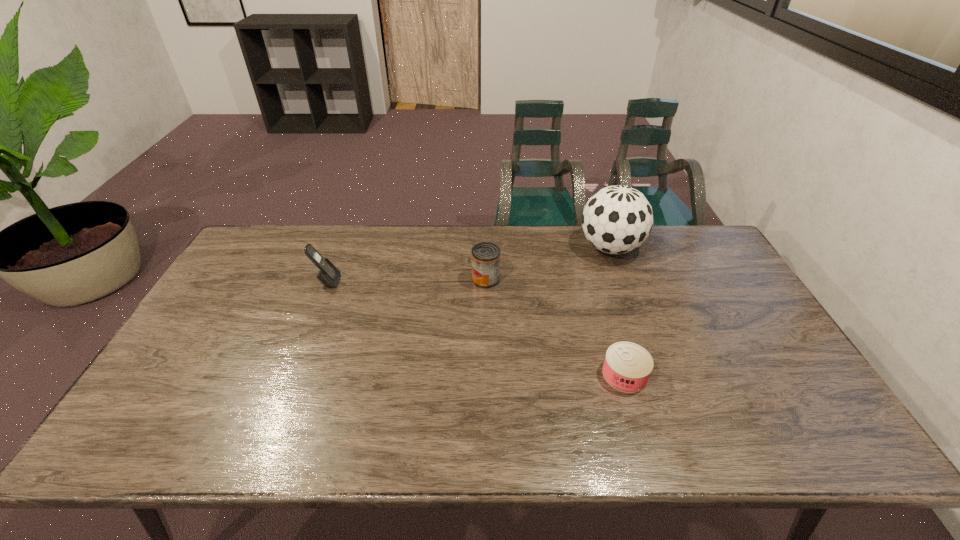
Locate an element on the screen. The width and height of the screenshot is (960, 540). empty space between the third object from right to left and the shorter can is located at coordinates (555, 327).

At what (x,y) coordinates should I click in order to perform the action: click on vacant space that's between the shortest object and the leftmost object. Please return your answer as a coordinate pair (x, y). The height and width of the screenshot is (540, 960). Looking at the image, I should click on (476, 328).

Identify the location of free spot between the shortest object and the farthest object. (617, 311).

You are a GUI agent. You are given a task and a screenshot of the screen. Output one action in this format:
    pyautogui.click(x=<x>, y=<y>)
    Task: Click on the free space between the nearer can and the leftmost object
    
    Given the screenshot: What is the action you would take?
    pyautogui.click(x=476, y=328)

In order to click on free spot between the farthest object and the nearest object in this screenshot , I will do `click(617, 311)`.

The image size is (960, 540). I want to click on unoccupied area between the third tallest object and the cellular telephone, so point(406,280).

Find the location of a particular element. This screenshot has height=540, width=960. vacant space that's between the shorter can and the farthest object is located at coordinates (617, 311).

This screenshot has width=960, height=540. What are the coordinates of `the closest object to the farther can` in the screenshot? It's located at (617, 219).

Where is `object that can be found as the third closest to the leftmost object`? This screenshot has height=540, width=960. object that can be found as the third closest to the leftmost object is located at coordinates (627, 366).

Image resolution: width=960 pixels, height=540 pixels. Identify the location of free space that satisfies the following two spatial constraints: 1. on the back side of the farthest object; 2. on the right side of the nearer can. (587, 247).